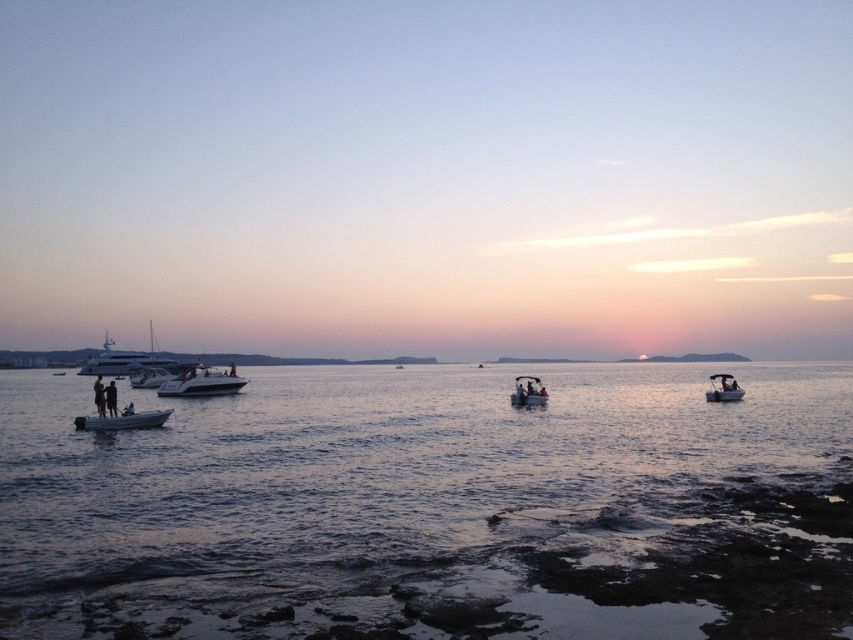
Question: Does shiny silver yacht at left appear under metallic silver dinghy at center right?

Choices:
 (A) yes
 (B) no

Answer: (A)

Question: Among these points, which one is nearest to the camera?

Choices:
 (A) click(x=84, y=422)
 (B) click(x=138, y=371)
 (C) click(x=531, y=385)

Answer: (A)

Question: Is white glossy sailboat at left bigger than metallic silver boat at center?

Choices:
 (A) no
 (B) yes

Answer: (B)

Question: Is shiny silver speedboat at left to the left of shiny silver yacht at left from the viewer's perspective?

Choices:
 (A) no
 (B) yes

Answer: (A)

Question: Which of the following is the closest to the observer?

Choices:
 (A) white glossy sailboat at left
 (B) white matte boat at lower left
 (C) metallic silver dinghy at center right
 (D) white matte boat at left

Answer: (B)

Question: Which point is farther to the camera?

Choices:
 (A) (125, 364)
 (B) (132, 412)
 (C) (178, 552)

Answer: (A)